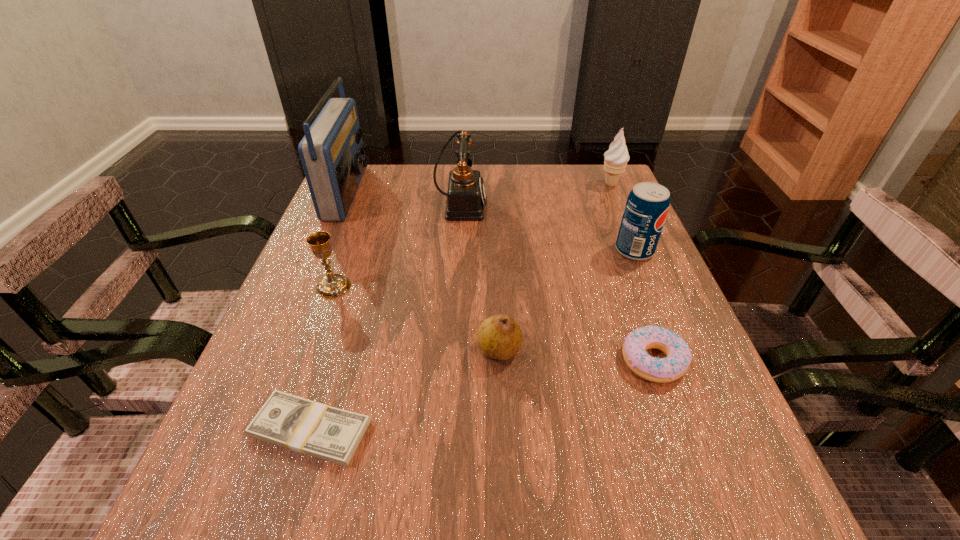
This screenshot has height=540, width=960. I want to click on free space located 0.330m on the front panel of the radio receiver, so click(x=487, y=192).

Identify the location of vacant space located on the front of the telephone at the rotary dial. The image size is (960, 540). (545, 205).

Identify the location of free region located on the front-facing side of the icecream. (624, 213).

Find the location of a particular element. vacant region located on the left of the fourth farthest object is located at coordinates (468, 251).

The width and height of the screenshot is (960, 540). Find the location of `vacant space situated 0.060m on the front of the fifth farthest object`. vacant space situated 0.060m on the front of the fifth farthest object is located at coordinates (322, 321).

This screenshot has width=960, height=540. Identify the location of vacant space located on the left of the pear. (257, 350).

Identify the location of vacant space situated on the back of the doughnut. Image resolution: width=960 pixels, height=540 pixels. (608, 233).

At what (x,y) coordinates should I click in order to perform the action: click on vacant space located on the right of the shortest object. Please return your answer as a coordinate pair (x, y). The height and width of the screenshot is (540, 960). Looking at the image, I should click on (563, 430).

Find the location of a particular element. radio receiver at the far edge is located at coordinates (332, 153).

Where is `telephone at the far edge`? This screenshot has height=540, width=960. telephone at the far edge is located at coordinates pyautogui.click(x=466, y=197).